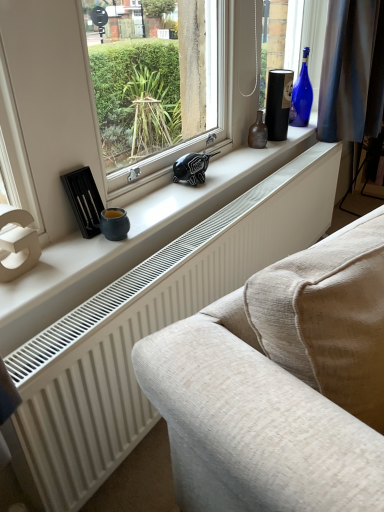
Where is `free spot to the right of brown glass bottle at center, positioned as the second bottle in right-to-left order`? Image resolution: width=384 pixels, height=512 pixels. free spot to the right of brown glass bottle at center, positioned as the second bottle in right-to-left order is located at coordinates (280, 142).